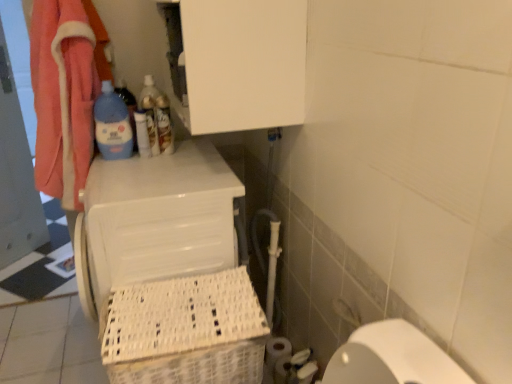
In order to face white matte toilet paper at lower right, the third toilet paper viewed from the back, should I rotate leftwards or rightwards?

Turn right approximately 6.724 degrees to face it.

You are a GUI agent. You are given a task and a screenshot of the screen. Output one action in this format:
    pyautogui.click(x=<x>, y=<y>)
    Task: Click on the white plastic laundry basket at lower left
    This screenshot has height=384, width=512.
    Given the screenshot: What is the action you would take?
    pyautogui.click(x=169, y=270)

Measure the distance between point (162, 133) and camera.

Point (162, 133) and camera are 1.63 meters apart from each other.

What do you see at coordinates (164, 124) in the screenshot?
I see `translucent plastic bottle at upper center, positioned as the first bottle in right-to-left order` at bounding box center [164, 124].

Measure the distance between point (277, 338) and camera.

Result: The distance of point (277, 338) from camera is 1.81 meters.

What do you see at coordinates (291, 363) in the screenshot? I see `white matte toilet paper at lower right, which is the 2th toilet paper in back-to-front order` at bounding box center [291, 363].

Describe the element at coordinates (112, 125) in the screenshot. The width and height of the screenshot is (512, 384). I see `blue glossy bottle at upper left, marked as the 3th bottle in a right-to-left arrangement` at that location.

Where is `white matte toilet paper at lower right, the third toilet paper viewed from the back`? white matte toilet paper at lower right, the third toilet paper viewed from the back is located at coordinates (301, 367).

Can you see blue glossy bottle at upper left, arranged as the first bottle when viewed from the left, touching translucent plastic bottle at upper center, placed as the 2th bottle when sorted from right to left?

There is a gap between blue glossy bottle at upper left, arranged as the first bottle when viewed from the left, and translucent plastic bottle at upper center, placed as the 2th bottle when sorted from right to left.

In the scene shown: Considering the relative positions of blue glossy bottle at upper left, arranged as the first bottle when viewed from the left, and translucent plastic bottle at upper center, placed as the 2th bottle when sorted from right to left, in the image provided, is blue glossy bottle at upper left, arranged as the first bottle when viewed from the left, behind translucent plastic bottle at upper center, placed as the 2th bottle when sorted from right to left,?

No.

Considering the sizes of objects blue glossy bottle at upper left, arranged as the first bottle when viewed from the left, and translucent plastic bottle at upper center, placed as the 2th bottle when sorted from right to left, in the image provided, who is wider, blue glossy bottle at upper left, arranged as the first bottle when viewed from the left, or translucent plastic bottle at upper center, placed as the 2th bottle when sorted from right to left,?

Wider between the two is blue glossy bottle at upper left, arranged as the first bottle when viewed from the left.

From a real-world perspective, is blue glossy bottle at upper left, marked as the 3th bottle in a right-to-left arrangement, positioned under translucent plastic bottle at upper center, placed as the 2th bottle when sorted from right to left, based on gravity?

No, from a real-world perspective, blue glossy bottle at upper left, marked as the 3th bottle in a right-to-left arrangement, is not under translucent plastic bottle at upper center, placed as the 2th bottle when sorted from right to left.

Can you see translucent plastic bottle at upper center, which is the second bottle in left-to-right order, touching white plastic laundry basket at lower left?

translucent plastic bottle at upper center, which is the second bottle in left-to-right order, and white plastic laundry basket at lower left are clearly separated.

Is translucent plastic bottle at upper center, placed as the 2th bottle when sorted from right to left, positioned with its back to white plastic laundry basket at lower left?

No.

Can you confirm if translucent plastic bottle at upper center, which is the second bottle in left-to-right order, is positioned to the right of white plastic laundry basket at lower left?

Incorrect, translucent plastic bottle at upper center, which is the second bottle in left-to-right order, is not on the right side of white plastic laundry basket at lower left.

In terms of size, does translucent plastic bottle at upper center, positioned as the first bottle in right-to-left order, appear bigger or smaller than white matte toilet paper at lower right, which is the 1th toilet paper in front-to-back order?

Clearly, translucent plastic bottle at upper center, positioned as the first bottle in right-to-left order, is smaller in size than white matte toilet paper at lower right, which is the 1th toilet paper in front-to-back order.

Is translucent plastic bottle at upper center, the 3th bottle in the left-to-right sequence, to the left or to the right of white matte toilet paper at lower right, the third toilet paper viewed from the back, in the image?

Clearly, translucent plastic bottle at upper center, the 3th bottle in the left-to-right sequence, is on the left of white matte toilet paper at lower right, the third toilet paper viewed from the back, in the image.

Is translucent plastic bottle at upper center, positioned as the first bottle in right-to-left order, positioned before white matte toilet paper at lower right, which is the 1th toilet paper in front-to-back order?

No.

From the image's perspective, is translucent plastic bottle at upper center, positioned as the first bottle in right-to-left order, located above or below white matte toilet paper at lower right, the third toilet paper viewed from the back?

Clearly, from the image's perspective, translucent plastic bottle at upper center, positioned as the first bottle in right-to-left order, is above white matte toilet paper at lower right, the third toilet paper viewed from the back.

Which object is positioned more to the right, white plastic basket at lower left or white matte toilet paper at lower right, the first toilet paper viewed from the back?

Positioned to the right is white matte toilet paper at lower right, the first toilet paper viewed from the back.

Would you say white plastic basket at lower left is outside white matte toilet paper at lower right, the third toilet paper in the front-to-back sequence?

Yes.

Consider the image. Is white plastic basket at lower left positioned far away from white matte toilet paper at lower right, the third toilet paper in the front-to-back sequence?

No, white plastic basket at lower left is in close proximity to white matte toilet paper at lower right, the third toilet paper in the front-to-back sequence.

Is white plastic basket at lower left wider or thinner than white matte toilet paper at lower right, the first toilet paper viewed from the back?

Considering their sizes, white plastic basket at lower left looks broader than white matte toilet paper at lower right, the first toilet paper viewed from the back.

What's the angular difference between white plastic basket at lower left and translucent plastic bottle at upper center, the 3th bottle in the left-to-right sequence,'s facing directions?

They differ by 94.1 degrees in their facing directions.

Is white plastic basket at lower left directly adjacent to translucent plastic bottle at upper center, positioned as the first bottle in right-to-left order?

white plastic basket at lower left is not next to translucent plastic bottle at upper center, positioned as the first bottle in right-to-left order, and they're not touching.

The width and height of the screenshot is (512, 384). What are the coordinates of `basket that appears on the right of translucent plastic bottle at upper center, the 3th bottle in the left-to-right sequence` in the screenshot? It's located at (186, 331).

From a real-world perspective, is white plastic basket at lower left under translucent plastic bottle at upper center, the 3th bottle in the left-to-right sequence?

Yes, from a real-world perspective, white plastic basket at lower left is under translucent plastic bottle at upper center, the 3th bottle in the left-to-right sequence.

From the image's perspective, is white matte toilet paper at lower right, which is the 2th toilet paper in back-to-front order, over translucent plastic bottle at upper center, which is the second bottle in left-to-right order?

No, from the image's perspective, white matte toilet paper at lower right, which is the 2th toilet paper in back-to-front order, is not above translucent plastic bottle at upper center, which is the second bottle in left-to-right order.

Is white matte toilet paper at lower right, placed as the second toilet paper when sorted from front to back, positioned in front of translucent plastic bottle at upper center, placed as the 2th bottle when sorted from right to left?

Yes, it is.

From a real-world perspective, which object rests below the other?

white matte toilet paper at lower right, which is the 2th toilet paper in back-to-front order, is physically lower.

Based on their positions, is white matte toilet paper at lower right, which is the 2th toilet paper in back-to-front order, located to the left or right of translucent plastic bottle at upper center, which is the second bottle in left-to-right order?

white matte toilet paper at lower right, which is the 2th toilet paper in back-to-front order, is to the right of translucent plastic bottle at upper center, which is the second bottle in left-to-right order.

Can you confirm if white plastic basket at lower left is wider than white matte toilet paper at lower right, which is the 2th toilet paper in back-to-front order?

Correct, the width of white plastic basket at lower left exceeds that of white matte toilet paper at lower right, which is the 2th toilet paper in back-to-front order.

Is white matte toilet paper at lower right, placed as the second toilet paper when sorted from front to back, located within white plastic basket at lower left?

That's incorrect, white matte toilet paper at lower right, placed as the second toilet paper when sorted from front to back, is not inside white plastic basket at lower left.

Would you consider white plastic basket at lower left to be distant from white matte toilet paper at lower right, which is the 2th toilet paper in back-to-front order?

white plastic basket at lower left is actually quite close to white matte toilet paper at lower right, which is the 2th toilet paper in back-to-front order.

This screenshot has height=384, width=512. In order to click on bottle that is above the translucent plastic bottle at upper center, placed as the 2th bottle when sorted from right to left (from a real-world perspective) in this screenshot , I will do [x=112, y=125].

Image resolution: width=512 pixels, height=384 pixels. What are the coordinates of `the 2nd bottle behind the white plastic laundry basket at lower left, counting from the anchor's position` in the screenshot? It's located at 150,112.

Based on their spatial positions, is white matte toilet paper at lower right, the third toilet paper viewed from the back, or white matte toilet paper at lower right, the third toilet paper in the front-to-back sequence, further from translucent plastic bottle at upper center, positioned as the first bottle in right-to-left order?

white matte toilet paper at lower right, the third toilet paper viewed from the back, is further to translucent plastic bottle at upper center, positioned as the first bottle in right-to-left order.

When comparing their distances from white matte toilet paper at lower right, the third toilet paper viewed from the back, does white matte toilet paper at lower right, placed as the second toilet paper when sorted from front to back, or blue glossy bottle at upper left, arranged as the first bottle when viewed from the left, seem further?

Among the two, blue glossy bottle at upper left, arranged as the first bottle when viewed from the left, is located further to white matte toilet paper at lower right, the third toilet paper viewed from the back.

Looking at the image, which one is located further to white matte toilet paper at lower right, placed as the second toilet paper when sorted from front to back, white matte toilet paper at lower right, the first toilet paper viewed from the back, or translucent plastic bottle at upper center, the 3th bottle in the left-to-right sequence?

The object further to white matte toilet paper at lower right, placed as the second toilet paper when sorted from front to back, is translucent plastic bottle at upper center, the 3th bottle in the left-to-right sequence.

When comparing their distances from translucent plastic bottle at upper center, which is the second bottle in left-to-right order, does translucent plastic bottle at upper center, positioned as the first bottle in right-to-left order, or blue glossy bottle at upper left, arranged as the first bottle when viewed from the left, seem closer?

Among the two, translucent plastic bottle at upper center, positioned as the first bottle in right-to-left order, is located nearer to translucent plastic bottle at upper center, which is the second bottle in left-to-right order.

Estimate the real-world distances between objects in this image. Which object is closer to blue glossy bottle at upper left, arranged as the first bottle when viewed from the left, white plastic laundry basket at lower left or white matte toilet paper at lower right, the first toilet paper viewed from the back?

Based on the image, white plastic laundry basket at lower left appears to be nearer to blue glossy bottle at upper left, arranged as the first bottle when viewed from the left.

Considering their positions, is white matte toilet paper at lower right, which is the 1th toilet paper in front-to-back order, positioned further to translucent plastic bottle at upper center, positioned as the first bottle in right-to-left order, than translucent plastic bottle at upper center, placed as the 2th bottle when sorted from right to left?

white matte toilet paper at lower right, which is the 1th toilet paper in front-to-back order, is positioned further to the anchor translucent plastic bottle at upper center, positioned as the first bottle in right-to-left order.

Consider the image. Based on their spatial positions, is white plastic basket at lower left or white matte toilet paper at lower right, the first toilet paper viewed from the back, closer to translucent plastic bottle at upper center, placed as the 2th bottle when sorted from right to left?

Among the two, white plastic basket at lower left is located nearer to translucent plastic bottle at upper center, placed as the 2th bottle when sorted from right to left.

Which object lies further to the anchor point white plastic laundry basket at lower left, white matte toilet paper at lower right, the first toilet paper viewed from the back, or translucent plastic bottle at upper center, placed as the 2th bottle when sorted from right to left?

white matte toilet paper at lower right, the first toilet paper viewed from the back, is positioned further to the anchor white plastic laundry basket at lower left.

At what (x,y) coordinates should I click in order to perform the action: click on basket between translucent plastic bottle at upper center, placed as the 2th bottle when sorted from right to left, and white matte toilet paper at lower right, which is the 2th toilet paper in back-to-front order, in the vertical direction. Please return your answer as a coordinate pair (x, y). This screenshot has height=384, width=512. Looking at the image, I should click on (186, 331).

The height and width of the screenshot is (384, 512). In order to click on basket between translucent plastic bottle at upper center, which is the second bottle in left-to-right order, and white matte toilet paper at lower right, which is the 1th toilet paper in front-to-back order, from top to bottom in this screenshot , I will do point(186,331).

Locate an element on the screen. The height and width of the screenshot is (384, 512). appliance between translucent plastic bottle at upper center, which is the second bottle in left-to-right order, and white matte toilet paper at lower right, which is the 1th toilet paper in front-to-back order, vertically is located at coordinates coord(169,270).

This screenshot has height=384, width=512. I want to click on basket that lies between blue glossy bottle at upper left, arranged as the first bottle when viewed from the left, and white matte toilet paper at lower right, the first toilet paper viewed from the back, from top to bottom, so click(x=186, y=331).